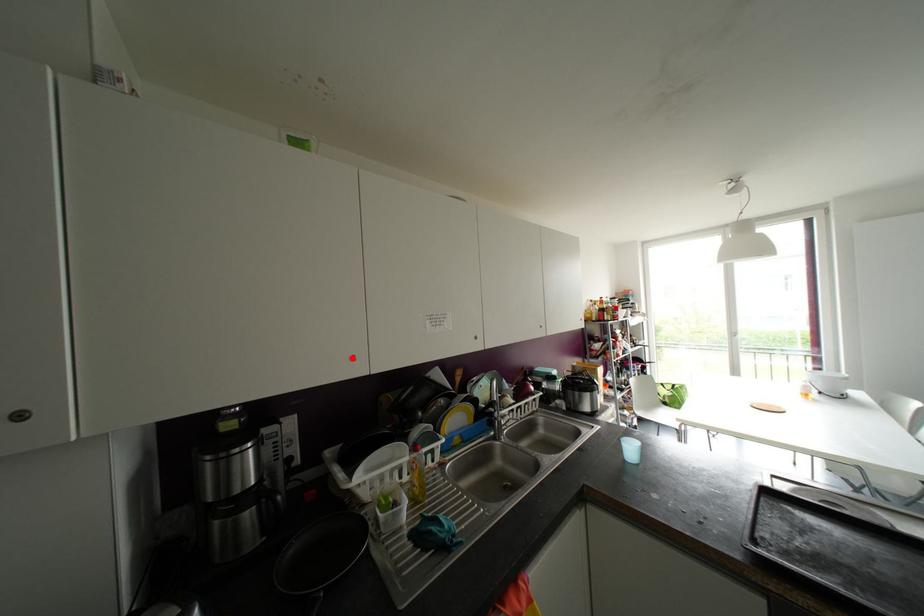
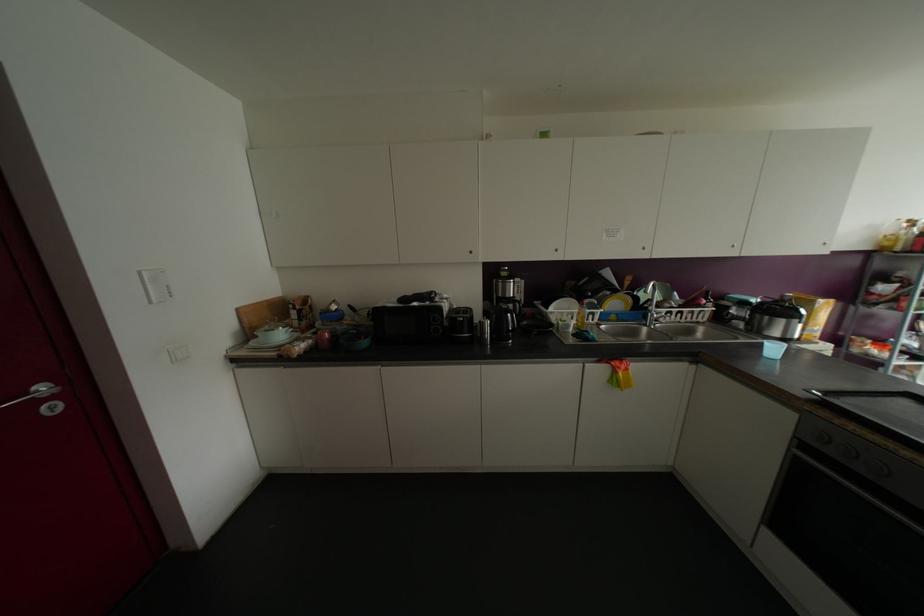
Locate, in the second image, the point that corresponds to the highlighted location in the first image.

(555, 249)